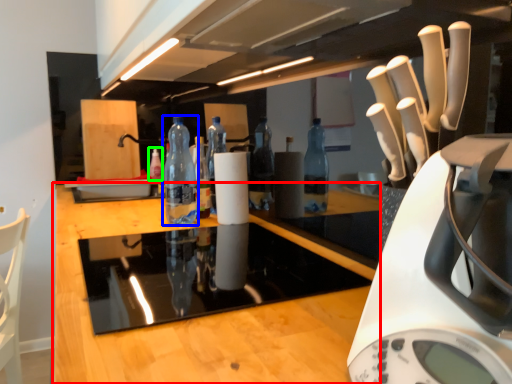
Question: Which is farther away from countertop (highlighted by a red box)? bottle (highlighted by a blue box) or bottle (highlighted by a green box)?

Choices:
 (A) bottle
 (B) bottle

Answer: (B)